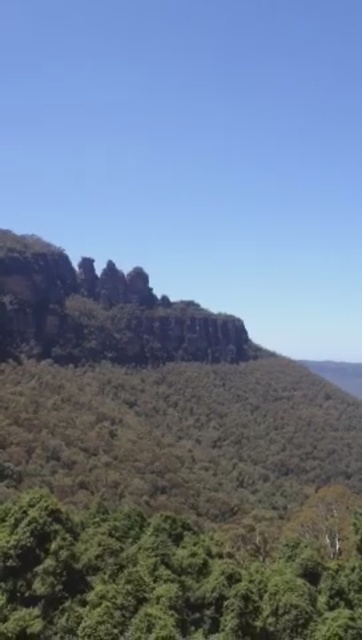
Question: Among these objects, which one is farthest from the camera?

Choices:
 (A) green leafy tree at lower center
 (B) rocky cliff at center

Answer: (B)

Question: Observing the image, what is the correct spatial positioning of rocky cliff at center in reference to green leafy tree at lower center?

Choices:
 (A) right
 (B) left

Answer: (B)

Question: Can you confirm if rocky cliff at center is bigger than green leafy tree at lower center?

Choices:
 (A) yes
 (B) no

Answer: (A)

Question: Which of the following is the farthest from the observer?

Choices:
 (A) rocky cliff at center
 (B) green leafy tree at lower center

Answer: (A)

Question: Which point appears farthest from the camera in this image?

Choices:
 (A) (267, 531)
 (B) (278, 570)

Answer: (A)

Question: Does rocky cliff at center have a greater width compared to green leafy tree at lower center?

Choices:
 (A) yes
 (B) no

Answer: (A)